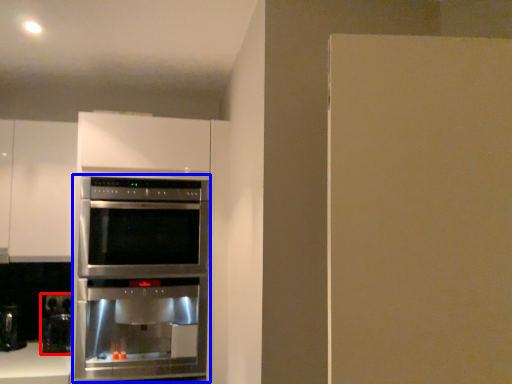
Question: Among these objects, which one is farthest to the camera, coffee machine (highlighted by a red box) or oven (highlighted by a blue box)?

Choices:
 (A) coffee machine
 (B) oven

Answer: (A)